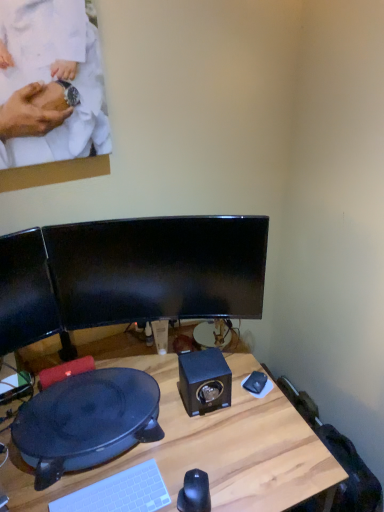
At what (x,y) coordinates should I click in order to perform the action: click on free space to the right of white plastic keyboard at lower center. Please return your answer as a coordinate pair (x, y). Image resolution: width=384 pixels, height=512 pixels. Looking at the image, I should click on (190, 468).